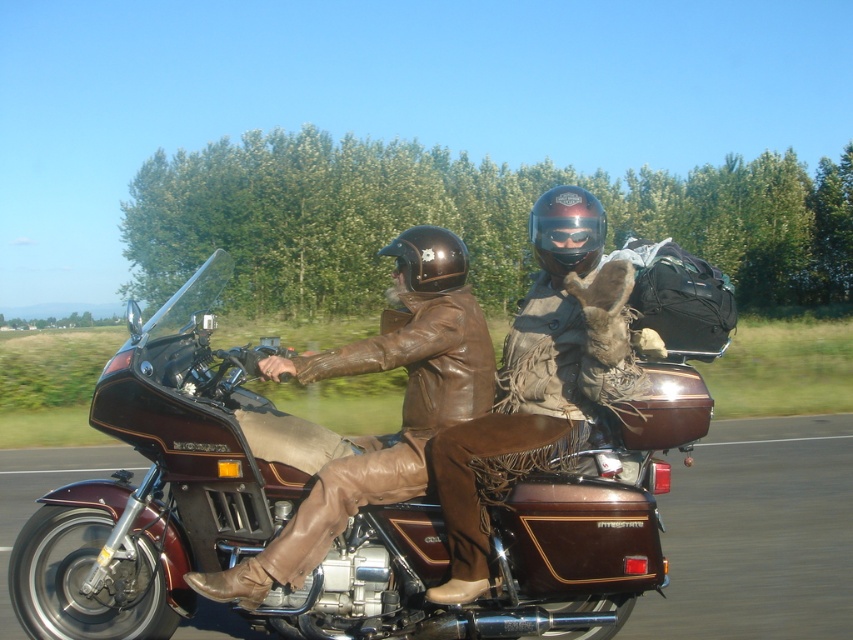
Is brown leather jacket at center bigger than shiny black helmet at center?

Yes, brown leather jacket at center is bigger than shiny black helmet at center.

Does point (447, 268) come in front of point (531, 220)?

Yes, point (447, 268) is closer to viewer.

At what (x,y) coordinates should I click in order to perform the action: click on brown leather jacket at center. Please return your answer as a coordinate pair (x, y). Looking at the image, I should click on (402, 408).

What do you see at coordinates (566, 230) in the screenshot? I see `shiny black helmet at center` at bounding box center [566, 230].

Does shiny black helmet at center appear over black matte helmet at center?

Yes, shiny black helmet at center is above black matte helmet at center.

The width and height of the screenshot is (853, 640). What are the coordinates of `shiny black helmet at center` in the screenshot? It's located at (566, 230).

Between brown leather motorcycle at center and black matte helmet at center, which one has more height?

brown leather motorcycle at center is taller.

Between brown leather motorcycle at center and black matte helmet at center, which one has less height?

black matte helmet at center is shorter.

Measure the distance between brown leather motorcycle at center and camera.

brown leather motorcycle at center is 12.55 feet from camera.

The width and height of the screenshot is (853, 640). I want to click on brown leather motorcycle at center, so click(165, 484).